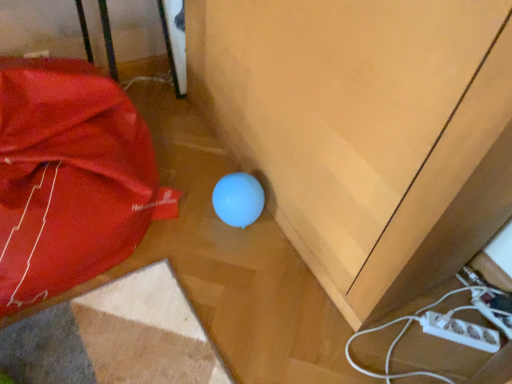
Question: From the image's perspective, is matte wood cabinet at center positioned above or below matte red umbrella at lower left?

Choices:
 (A) above
 (B) below

Answer: (A)

Question: Considering the positions of matte wood cabinet at center and matte red umbrella at lower left in the image, is matte wood cabinet at center wider or thinner than matte red umbrella at lower left?

Choices:
 (A) wide
 (B) thin

Answer: (B)

Question: Considering the relative positions of matte wood cabinet at center and matte red umbrella at lower left in the image provided, is matte wood cabinet at center to the left or to the right of matte red umbrella at lower left?

Choices:
 (A) left
 (B) right

Answer: (B)

Question: Would you say matte red umbrella at lower left is inside or outside matte wood cabinet at center?

Choices:
 (A) inside
 (B) outside

Answer: (B)

Question: Does point (116, 84) appear closer or farther from the camera than point (433, 195)?

Choices:
 (A) closer
 (B) farther

Answer: (B)

Question: From a real-world perspective, is matte red umbrella at lower left above or below matte wood cabinet at center?

Choices:
 (A) below
 (B) above

Answer: (A)

Question: Relative to matte wood cabinet at center, is matte red umbrella at lower left in front or behind?

Choices:
 (A) behind
 (B) front

Answer: (A)